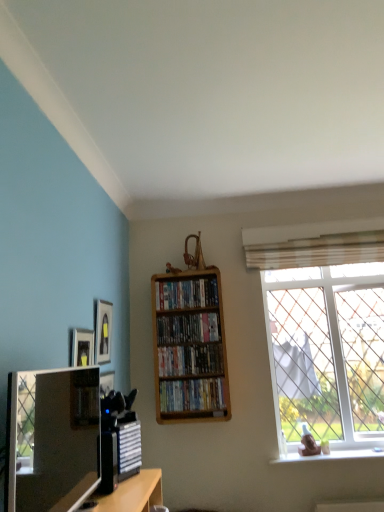
Question: Looking at the image, does satin black tv at lower left seem bigger or smaller compared to matte black picture frame at upper left?

Choices:
 (A) small
 (B) big

Answer: (B)

Question: Considering the relative positions of satin black tv at lower left and matte black picture frame at upper left in the image provided, is satin black tv at lower left to the left or to the right of matte black picture frame at upper left?

Choices:
 (A) right
 (B) left

Answer: (A)

Question: Estimate the real-world distances between objects in this image. Which object is closer to the matte black picture frame at upper left?

Choices:
 (A) matte plastic dvds at center, the second book viewed from the top
 (B) wooden bookshelf at center, the third book viewed from the top
 (C) wooden bookshelf at center, marked as the first book in a bottom-to-top arrangement
 (D) satin black tv at lower left
 (E) wooden bookcase at center

Answer: (A)

Question: Which is farther from the matte plastic dvds at center, the second book viewed from the top?

Choices:
 (A) wooden bookcase at center
 (B) wooden bookshelf at center, which ranks as the 2th book in bottom-to-top order
 (C) matte black picture frame at upper left
 (D) wooden bookshelf at center, the fourth book from the top
 (E) wooden shelf at center, which is the fourth book from bottom to top

Answer: (C)